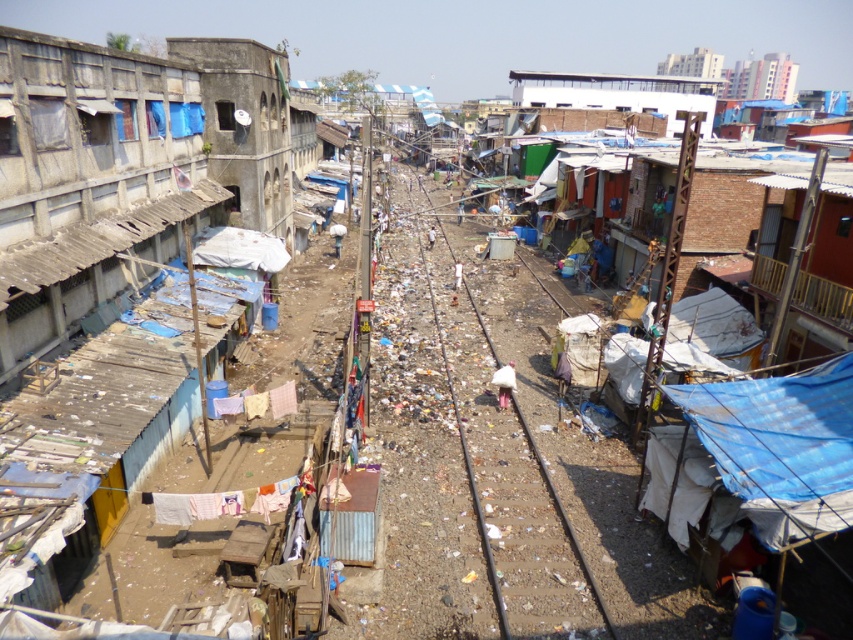
Is rusty corrugated metal hut at left bigger than smooth metal train track at center?

Actually, rusty corrugated metal hut at left might be smaller than smooth metal train track at center.

Who is taller, rusty corrugated metal hut at left or smooth metal train track at center?

smooth metal train track at center is taller.

What do you see at coordinates (125, 168) in the screenshot? I see `rusty corrugated metal hut at left` at bounding box center [125, 168].

Identify the location of rusty corrugated metal hut at left. (125, 168).

Is white corrugated metal hut at upper center further to the viewer compared to smooth metal train track at center?

Yes, it is behind smooth metal train track at center.

Is point (699, 81) farther from viewer compared to point (548, 483)?

That is True.

Does point (554, 76) lie in front of point (570, 541)?

That is False.

Locate an element on the screen. Image resolution: width=853 pixels, height=640 pixels. white corrugated metal hut at upper center is located at coordinates (618, 93).

Does rusty corrugated metal hut at left appear over white corrugated metal hut at upper center?

No, rusty corrugated metal hut at left is not above white corrugated metal hut at upper center.

The width and height of the screenshot is (853, 640). I want to click on rusty corrugated metal hut at left, so click(125, 168).

Locate an element on the screen. rusty corrugated metal hut at left is located at coordinates (125, 168).